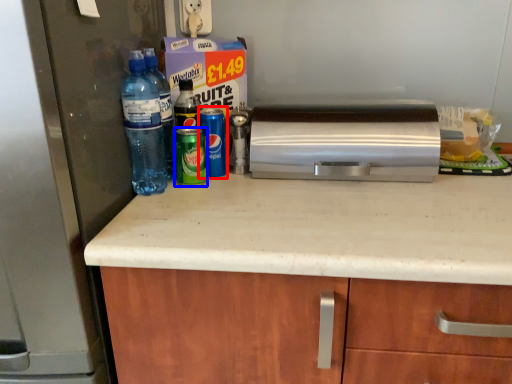
Question: Which point is closer to the camera, bottle (highlighted by a red box) or beverage (highlighted by a blue box)?

Choices:
 (A) bottle
 (B) beverage

Answer: (B)